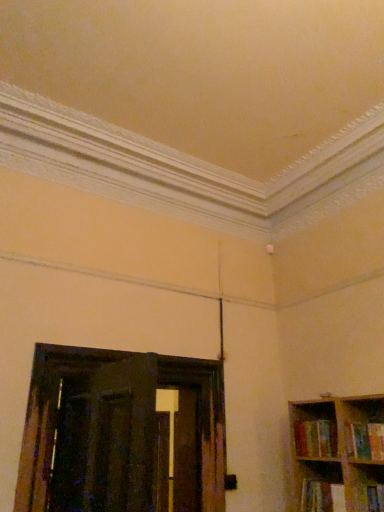
Question: Considering the positions of multicolored fabric book at lower right, the 1th book positioned from the bottom, and multicolored paperbacks at right, the second book when ordered from bottom to top, in the image, is multicolored fabric book at lower right, the 1th book positioned from the bottom, bigger or smaller than multicolored paperbacks at right, the second book when ordered from bottom to top,?

Choices:
 (A) small
 (B) big

Answer: (A)

Question: Considering the positions of multicolored fabric book at lower right, which appears as the third book when viewed from the top, and multicolored paperbacks at right, the second book when ordered from bottom to top, in the image, is multicolored fabric book at lower right, which appears as the third book when viewed from the top, wider or thinner than multicolored paperbacks at right, the second book when ordered from bottom to top,?

Choices:
 (A) wide
 (B) thin

Answer: (B)

Question: Estimate the real-world distances between objects in this image. Which object is closer to the multicolored fabric book at lower right, which appears as the third book when viewed from the top?

Choices:
 (A) multicolored paperbacks at right, which is counted as the second book, starting from the top
 (B) hardcover book at right, acting as the 3th book starting from the bottom

Answer: (A)

Question: Based on their relative distances, which object is nearer to the multicolored fabric book at lower right, which appears as the third book when viewed from the top?

Choices:
 (A) hardcover book at right, which is the first book from top to bottom
 (B) multicolored paperbacks at right, which is counted as the second book, starting from the top

Answer: (B)